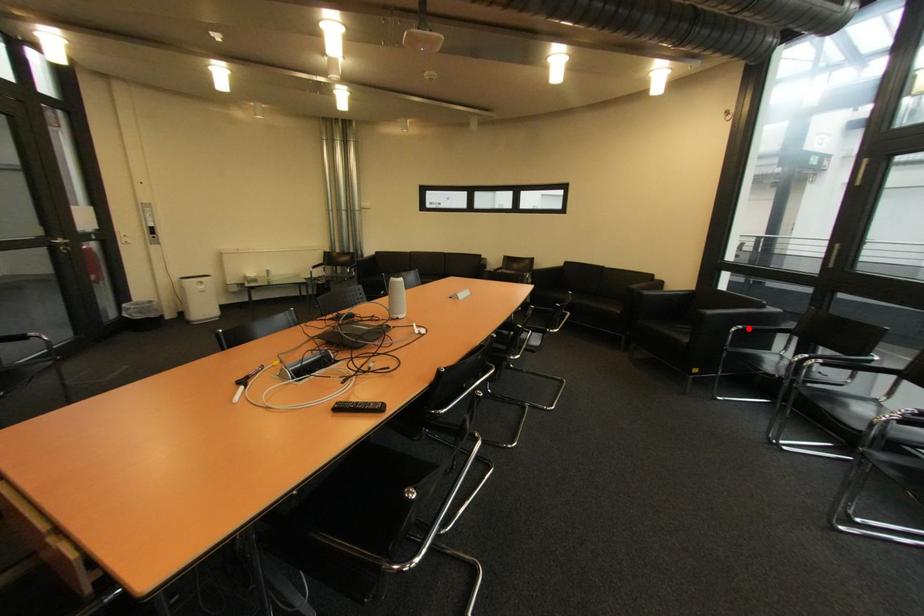
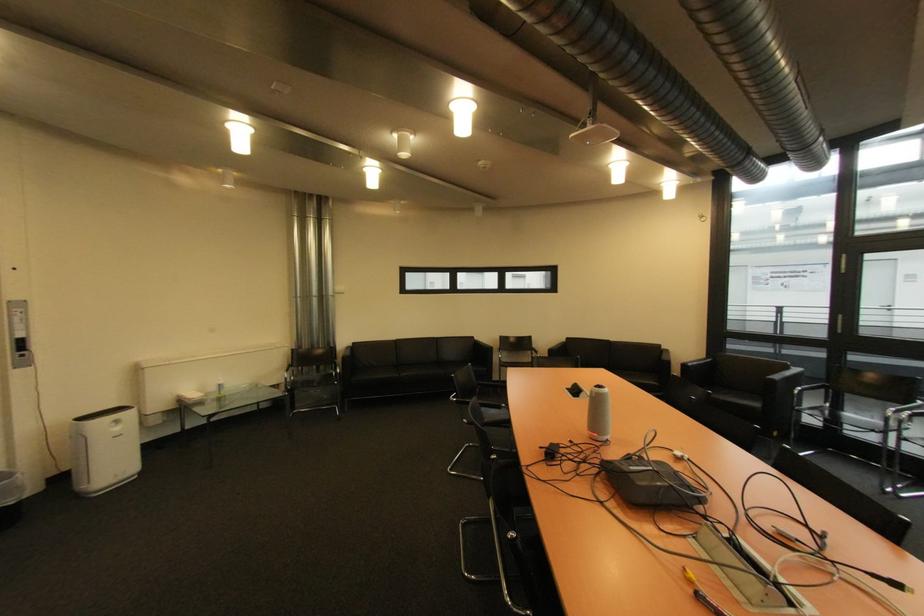
Question: I am providing you with two images of the same scene from different viewpoints. Image1 has a red point marked. In image2, the corresponding 3D location appears at what relative position? Reply with the corresponding letter.

Choices:
 (A) Closer
 (B) Farther

Answer: (A)